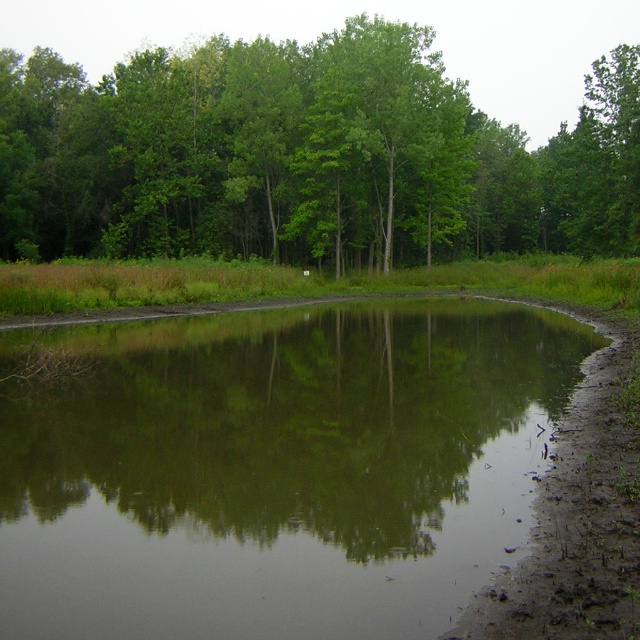
You are standing at the edge of the water and notice the green reflective mud at center and the green leafy trees at upper center. Which of these two objects appears narrower from your viewpoint?

The green reflective mud at center appears narrower than the green leafy trees at upper center because it has a lesser width compared to them.

You are standing at the edge of the water and want to place a small statue on the green reflective mud at center so that it can be seen from the green leafy trees at upper center. Will the statue be visible from there?

The green reflective mud at center is lower than the green leafy trees at upper center, so the statue placed on the green reflective mud at center may be partially obscured by the height difference unless it is elevated enough to be seen above the mud level.

You are standing at the edge of the water and want to reach the green reflective mud at center. The path is 5 meters long. Can you walk straight to it without needing to adjust your path?

The green reflective mud at center is 5.15 meters away from your current position. Since the path is only 5 meters long, you will need to walk a bit further to reach it.